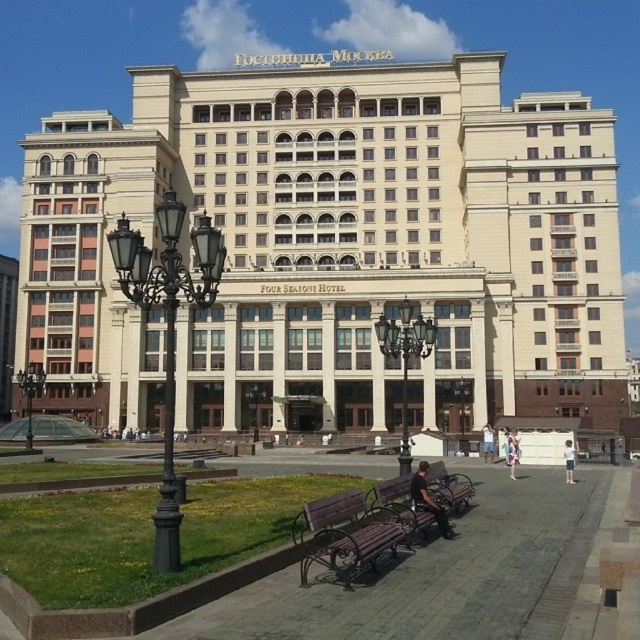
Question: Can you confirm if wooden bench at center is wider than wooden bench at lower center?

Choices:
 (A) yes
 (B) no

Answer: (A)

Question: Does wooden bench at center appear on the left side of black wrought iron streetlight at left?

Choices:
 (A) yes
 (B) no

Answer: (B)

Question: Which object is the closest to the white cotton shirt at lower center?

Choices:
 (A) black wrought iron streetlight at lower left
 (B) dark brown leather jacket at center

Answer: (B)

Question: Which object is the closest to the wooden park bench at center?

Choices:
 (A) polished brass streetlight at center
 (B) black wrought iron streetlight at left
 (C) beige stone four seasons hotel at center

Answer: (B)

Question: Which point appears farthest from the camera in this image?

Choices:
 (A) (422, 484)
 (B) (333, 412)

Answer: (B)

Question: In this image, where is wooden park bench at center located relative to wooden bench at lower center?

Choices:
 (A) left
 (B) right

Answer: (A)